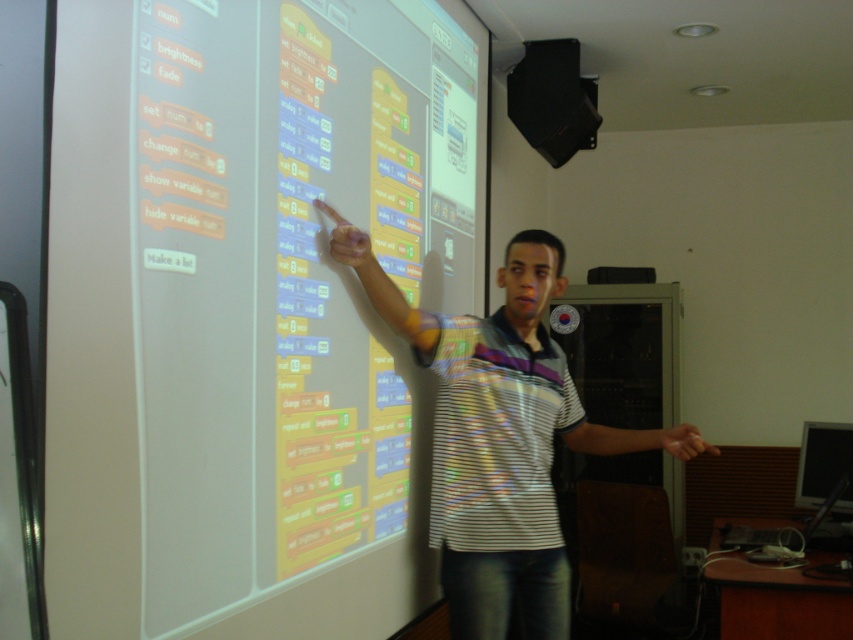
Question: Estimate the real-world distances between objects in this image. Which object is farther from the smooth skin hand at center?

Choices:
 (A) matte yellow finger at upper center
 (B) white striped shirt at center
 (C) white matte projection screen at upper left

Answer: (C)

Question: Does white matte projection screen at upper left have a lesser width compared to matte yellow finger at upper center?

Choices:
 (A) yes
 (B) no

Answer: (B)

Question: Which of the following is the farthest from the observer?

Choices:
 (A) (125, 221)
 (B) (648, 444)
 (C) (369, 248)

Answer: (B)

Question: Does white matte projection screen at upper left have a smaller size compared to white striped shirt at center?

Choices:
 (A) yes
 (B) no

Answer: (B)

Question: Is white striped shirt at center wider than matte yellow finger at upper center?

Choices:
 (A) no
 (B) yes

Answer: (B)

Question: Based on their relative distances, which object is farther from the smooth skin hand at center?

Choices:
 (A) white matte projection screen at upper left
 (B) white striped shirt at center
 (C) matte yellow finger at upper center

Answer: (A)